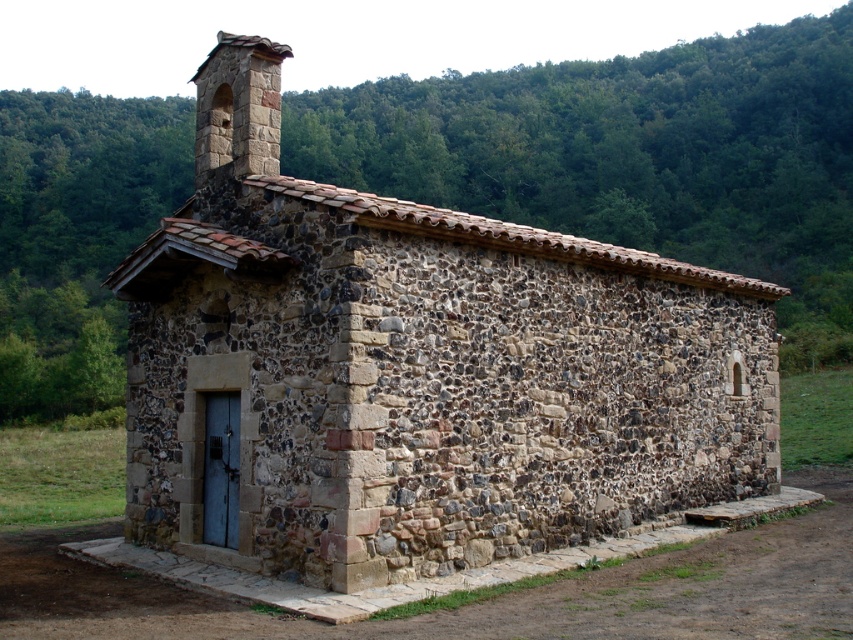
Question: Among these objects, which one is farthest from the camera?

Choices:
 (A) rustic stone church at center
 (B) rustic stone chimney at upper center

Answer: (B)

Question: Can you confirm if rustic stone church at center is wider than rustic stone chimney at upper center?

Choices:
 (A) no
 (B) yes

Answer: (A)

Question: Does rustic stone church at center come behind rustic stone chimney at upper center?

Choices:
 (A) yes
 (B) no

Answer: (B)

Question: Is rustic stone church at center bigger than rustic stone chimney at upper center?

Choices:
 (A) no
 (B) yes

Answer: (A)

Question: Which point is farther from the camera taking this photo?

Choices:
 (A) (262, 67)
 (B) (480, 220)

Answer: (B)